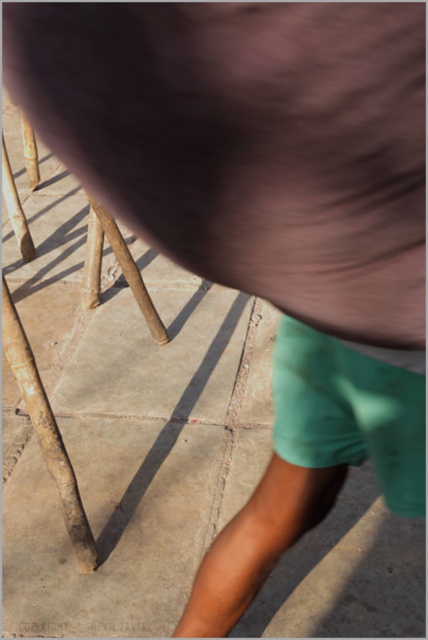
You are a photographer trying to capture a shot of the green cotton shorts at lower right and the brown wooden pole at lower left. Which object takes up more area in the photo?

The brown wooden pole at lower left takes up more area in the photo because it occupies more space than the green cotton shorts at lower right.

You are a photographer setting up a shoot. You need to place a 1.2 meter wide backdrop behind the green cotton shorts at lower right and the brown wooden pole at lower left. Based on their widths, which object requires more space horizontally to accommodate the backdrop?

The green cotton shorts at lower right require more horizontal space because their width surpasses that of the brown wooden pole at lower left.

You are standing on the light beige tiles in the image. You need to place a small potted plant between the green cotton shorts at lower right and the brown wooden pole at lower left. According to the scene, where should you position the plant?

The green cotton shorts at lower right is located above the brown wooden pole at lower left, so you should place the small potted plant between them on the tiles below the green cotton shorts at lower right and above the brown wooden pole at lower left.